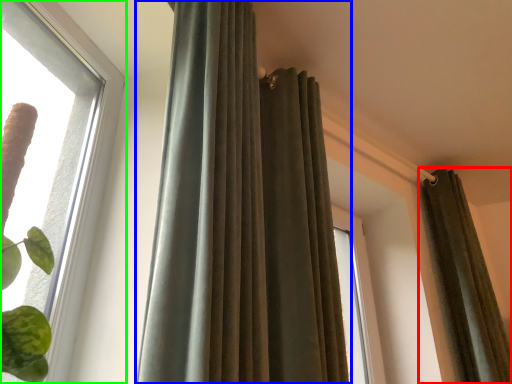
Question: Estimate the real-world distances between objects in this image. Which object is closer to curtain (highlighted by a red box), curtain (highlighted by a blue box) or window (highlighted by a green box)?

Choices:
 (A) curtain
 (B) window

Answer: (A)